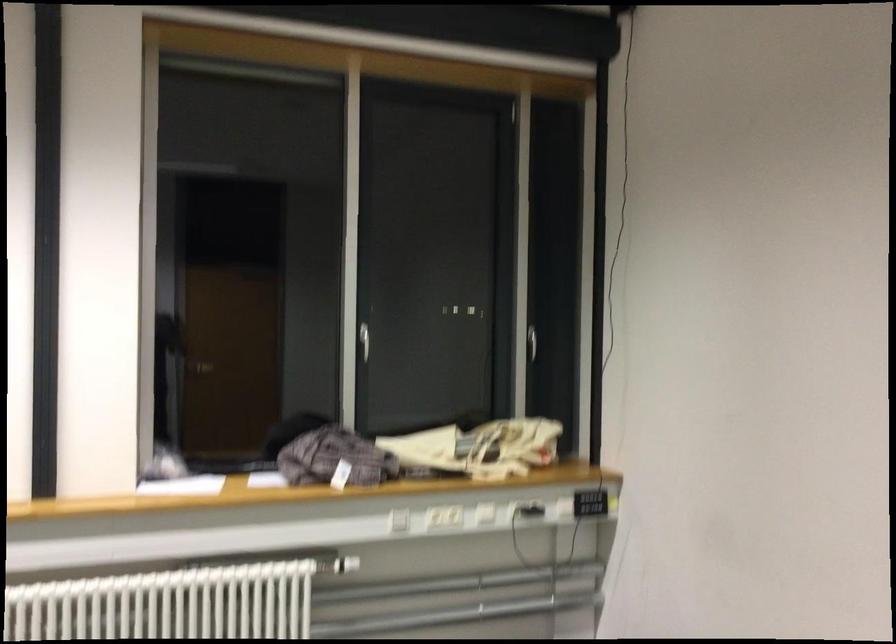
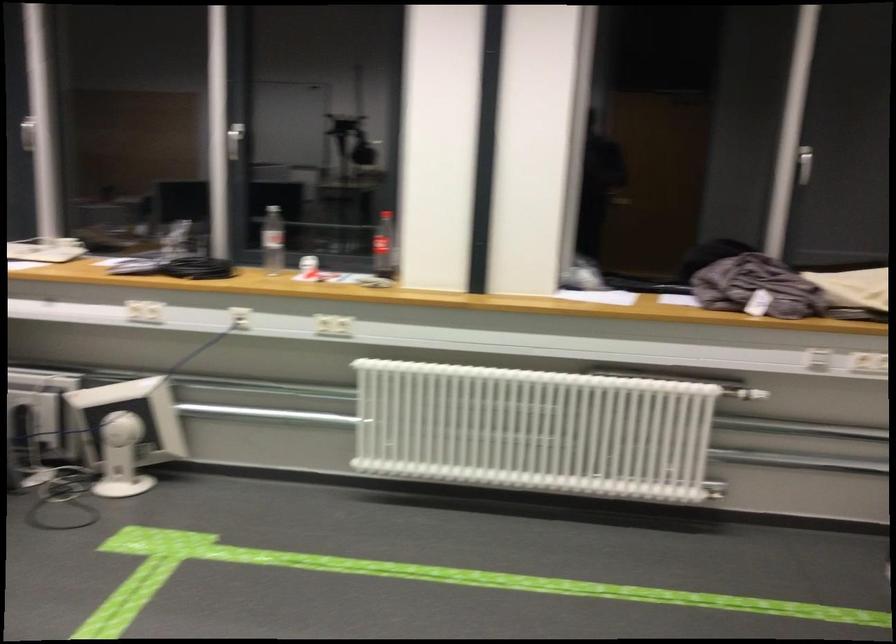
Where in the second image is the point corresponding to the point at 343,565 from the first image?

(751, 395)